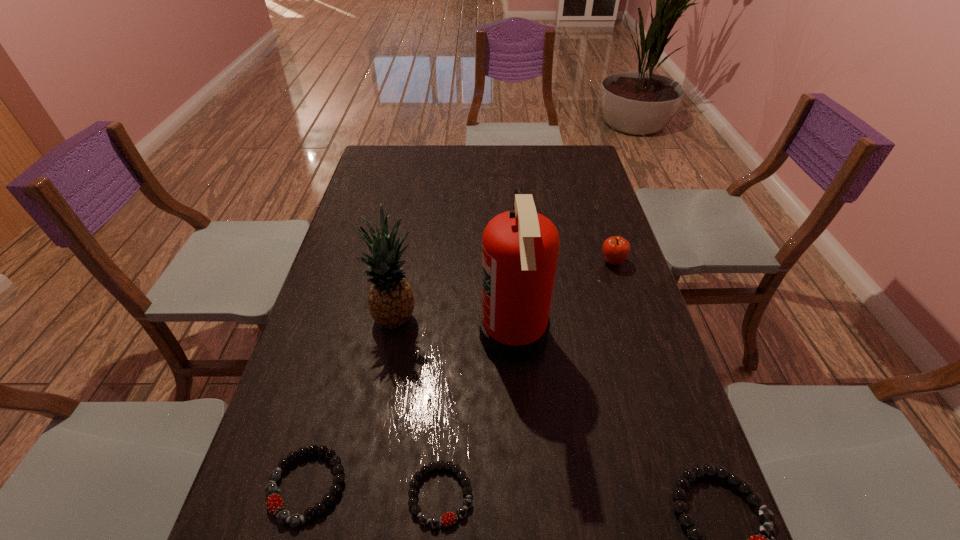
Find the location of `free space at the far edge of the desktop`. free space at the far edge of the desktop is located at coordinates (532, 158).

Locate an element on the screen. The image size is (960, 540). free location at the near edge is located at coordinates (350, 490).

The image size is (960, 540). What are the coordinates of `free spot at the left edge of the desktop` in the screenshot? It's located at (368, 194).

The image size is (960, 540). Identify the location of vacant space at the right edge of the desktop. (588, 210).

Where is `free space at the far left corner of the desktop`? The width and height of the screenshot is (960, 540). free space at the far left corner of the desktop is located at coordinates click(x=378, y=156).

I want to click on vacant space at the near right corner of the desktop, so click(x=674, y=480).

Find the location of a particular element. The width and height of the screenshot is (960, 540). vacant area that lies between the shortest bracelet and the apple is located at coordinates (527, 379).

Image resolution: width=960 pixels, height=540 pixels. Identify the location of vacant area that lies between the fire extinguisher and the pineapple. (455, 326).

I want to click on free point between the tallest object and the shortest bracelet, so click(477, 415).

What are the coordinates of `unoccupied position between the fourth object from left to right and the fourth shortest object` in the screenshot? It's located at (563, 298).